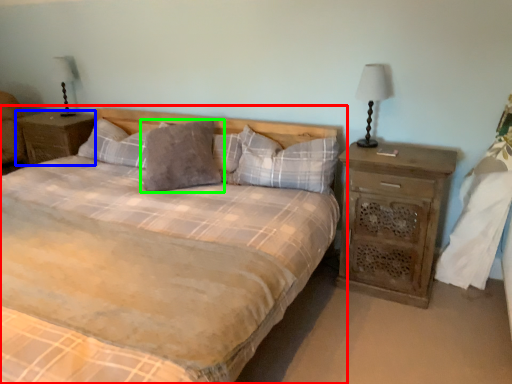
Question: Which is nearer to the bed (highlighted by a red box)? nightstand (highlighted by a blue box) or pillow (highlighted by a green box).

Choices:
 (A) nightstand
 (B) pillow

Answer: (B)